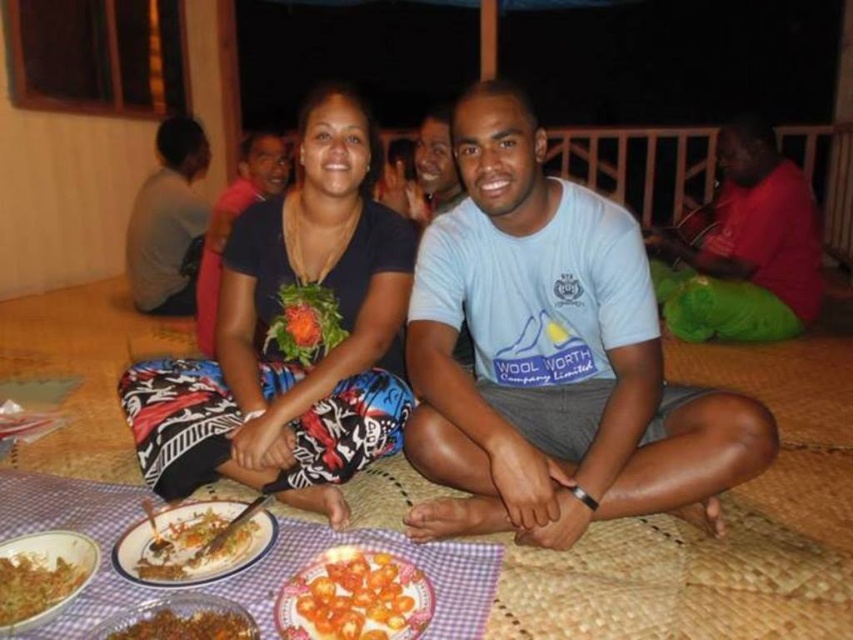
Question: Which of the following is the closest to the observer?

Choices:
 (A) black printed shirt at center
 (B) red cotton shirt at upper right
 (C) golden brown bread at center
 (D) brown crumbly mix at lower left

Answer: (D)

Question: Is smooth yellow tomatoes at center wider than golden brown bread at center?

Choices:
 (A) no
 (B) yes

Answer: (A)

Question: Is red cotton shirt at upper right wider than golden brown bread at center?

Choices:
 (A) no
 (B) yes

Answer: (B)

Question: Estimate the real-world distances between objects in this image. Which object is closer to the smooth yellow tomatoes at center?

Choices:
 (A) light blue cotton t-shirt at center
 (B) brown crumbly mix at lower left
 (C) gray fabric shirt at left

Answer: (B)

Question: Which of the following is the closest to the observer?

Choices:
 (A) red cotton shirt at upper right
 (B) brown crumbly mix at lower left

Answer: (B)

Question: Is black printed shirt at center to the right of smooth yellow tomatoes at center from the viewer's perspective?

Choices:
 (A) yes
 (B) no

Answer: (B)